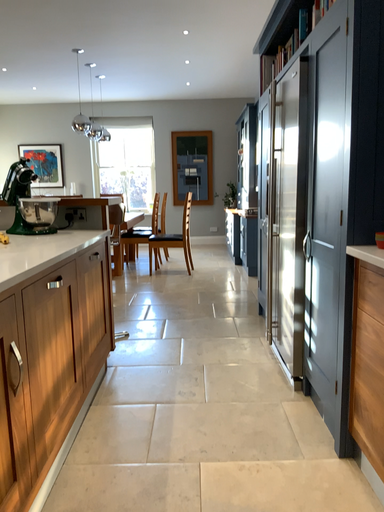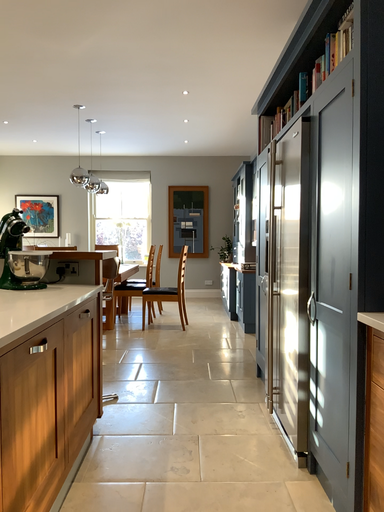
Question: How did the camera likely rotate when shooting the video?

Choices:
 (A) rotated upward
 (B) rotated downward

Answer: (A)